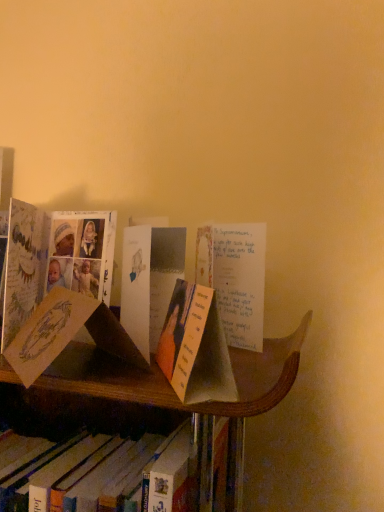
Question: Based on their positions, is white paper bookmark at center, the second book from the right, located to the left or right of orange paper bookmark at center, the second book in the bottom-to-top sequence?

Choices:
 (A) right
 (B) left

Answer: (B)

Question: Considering the positions of white paper bookmark at center, positioned as the first book in left-to-right order, and orange paper bookmark at center, which appears as the 1th book when viewed from the right, in the image, is white paper bookmark at center, positioned as the first book in left-to-right order, wider or thinner than orange paper bookmark at center, which appears as the 1th book when viewed from the right,?

Choices:
 (A) thin
 (B) wide

Answer: (B)

Question: Relative to orange paper bookmark at center, the second book in the bottom-to-top sequence, is white paper bookmark at center, marked as the 2th book in a top-to-bottom arrangement, in front or behind?

Choices:
 (A) front
 (B) behind

Answer: (B)

Question: Does point (201, 330) appear closer or farther from the camera than point (94, 486)?

Choices:
 (A) closer
 (B) farther

Answer: (A)

Question: From a real-world perspective, relative to white paper bookmark at center, which appears as the 1th book when ordered from the bottom, is orange paper bookmark at center, which appears as the 1th book when viewed from the right, vertically above or below?

Choices:
 (A) above
 (B) below

Answer: (A)

Question: Considering the positions of orange paper bookmark at center, the first book positioned from the top, and white paper bookmark at center, the second book from the right, in the image, is orange paper bookmark at center, the first book positioned from the top, taller or shorter than white paper bookmark at center, the second book from the right,?

Choices:
 (A) short
 (B) tall

Answer: (A)

Question: Is orange paper bookmark at center, the first book positioned from the top, to the left or to the right of white paper bookmark at center, which appears as the 1th book when ordered from the bottom, in the image?

Choices:
 (A) left
 (B) right

Answer: (B)